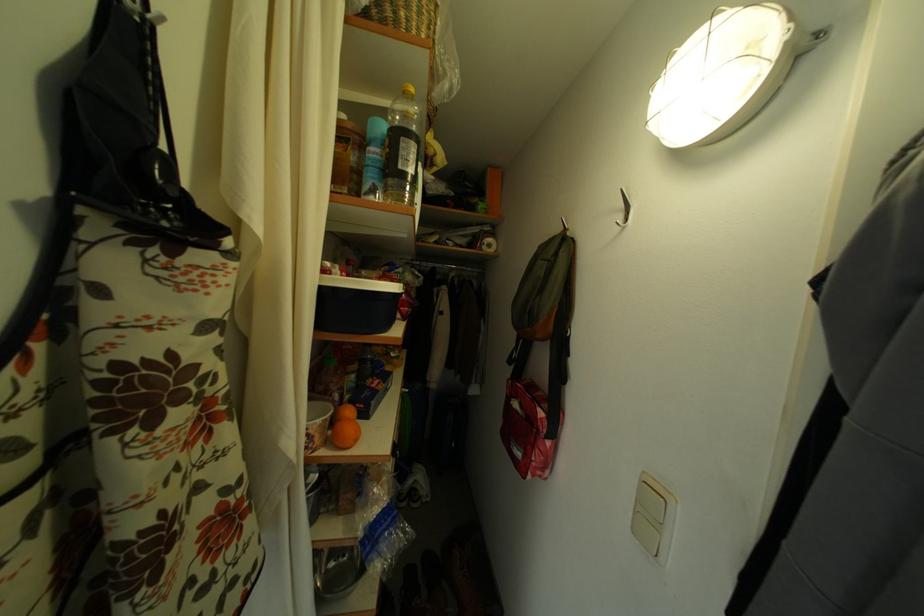
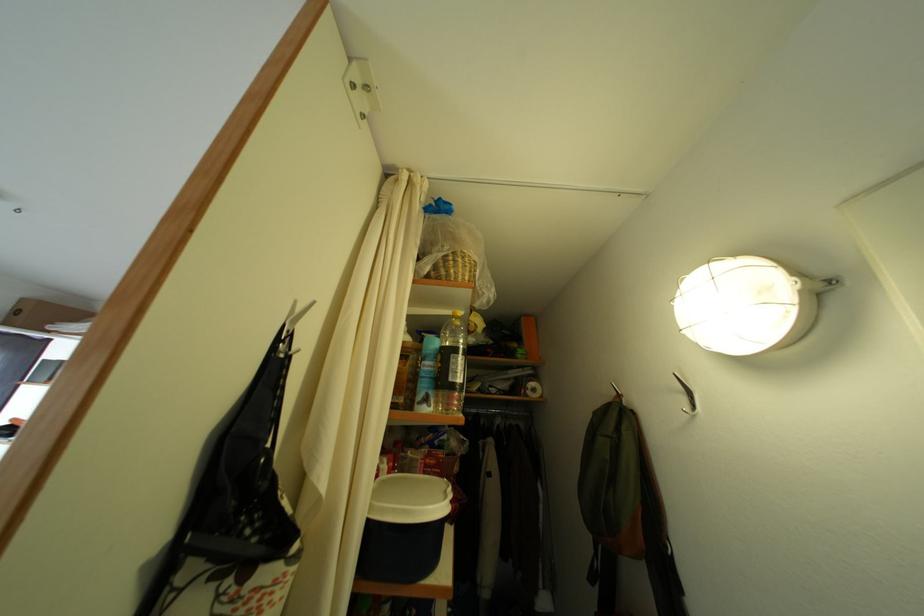
Question: I am providing you with two images of the same scene from different viewpoints. Which of the following objects are not visible in image2?

Choices:
 (A) clear plastic bottle
 (B) blue spray can
 (C) white container lid
 (D) none of these

Answer: (D)